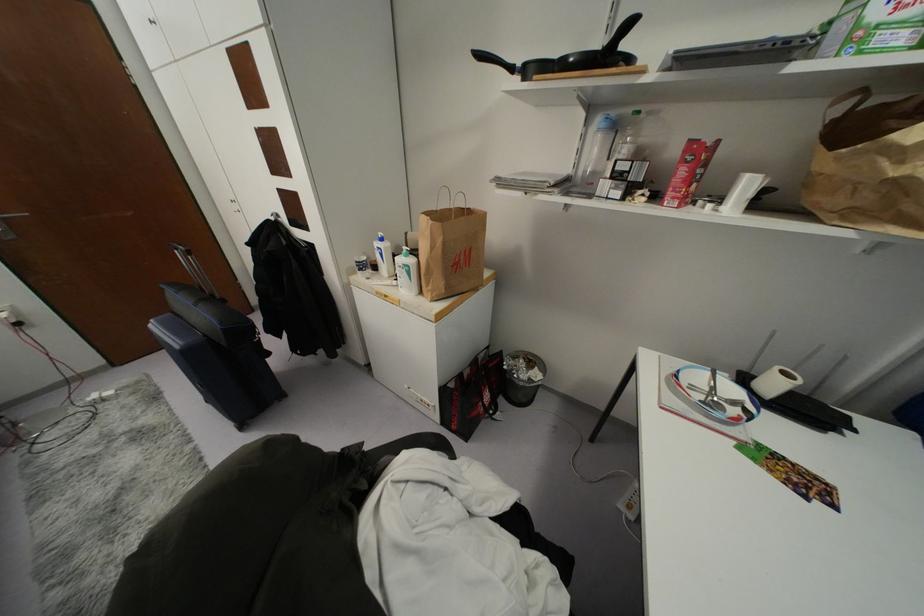
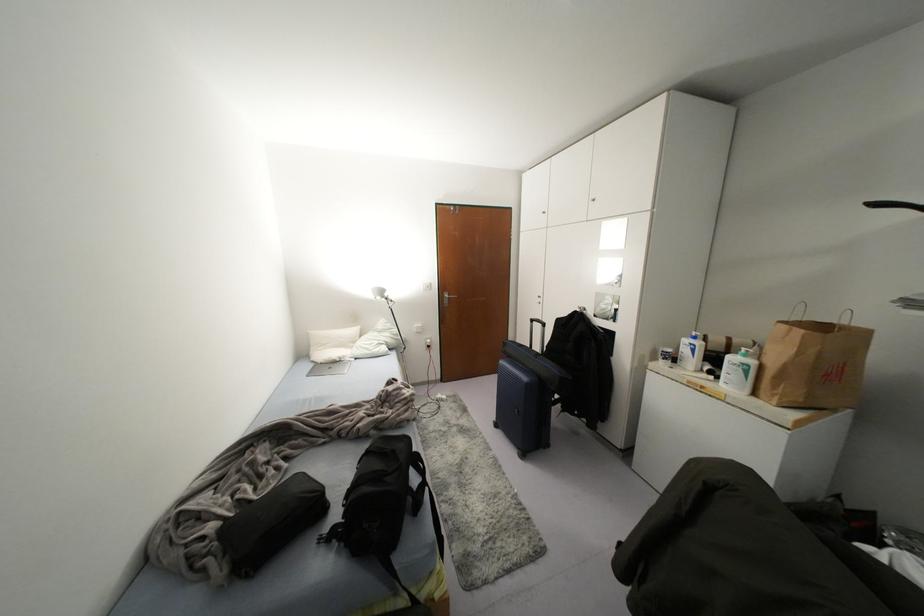
The point at (410, 261) is marked in the first image. Where is the corresponding point in the second image?

(751, 362)